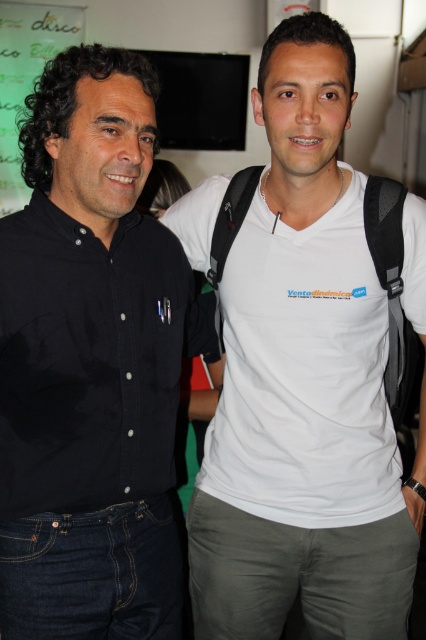
Can you confirm if white matte t-shirt at center is thinner than black matte shirt at left?

No, white matte t-shirt at center is not thinner than black matte shirt at left.

Does white matte t-shirt at center have a greater height compared to black matte shirt at left?

Correct, white matte t-shirt at center is much taller as black matte shirt at left.

The width and height of the screenshot is (426, 640). Describe the element at coordinates (304, 385) in the screenshot. I see `white matte t-shirt at center` at that location.

This screenshot has height=640, width=426. Find the location of `white matte t-shirt at center`. white matte t-shirt at center is located at coordinates tap(304, 385).

Which of these two, black matte shirt at left or green matte bulletin board at upper left, stands shorter?

black matte shirt at left

Who is lower down, black matte shirt at left or green matte bulletin board at upper left?

Positioned lower is black matte shirt at left.

Is point (28, 497) positioned after point (13, 51)?

No, it is in front of (13, 51).

You are a GUI agent. You are given a task and a screenshot of the screen. Output one action in this format:
    pyautogui.click(x=<x>, y=<y>)
    Task: Click on the black matte shirt at left
    
    Given the screenshot: What is the action you would take?
    pyautogui.click(x=92, y=364)

Is white matte t-shirt at center shorter than green matte bulletin board at upper left?

Correct, white matte t-shirt at center is not as tall as green matte bulletin board at upper left.

Which is behind, point (250, 634) or point (5, 195)?

The point (5, 195) is behind.

Describe the element at coordinates (304, 385) in the screenshot. The image size is (426, 640). I see `white matte t-shirt at center` at that location.

This screenshot has height=640, width=426. Find the location of `white matte t-shirt at center`. white matte t-shirt at center is located at coordinates (304, 385).